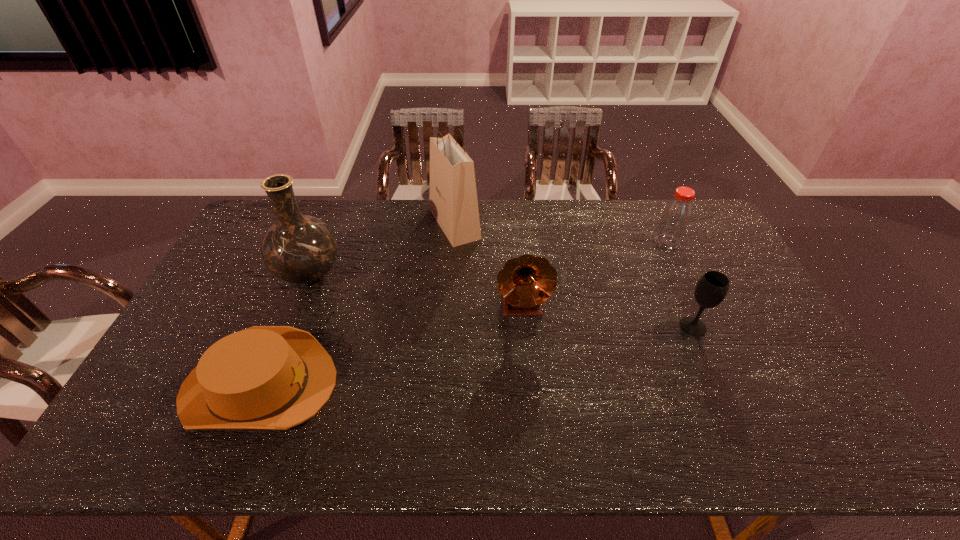
Locate an element on the screen. This screenshot has height=540, width=960. vacant space that's between the wineglass and the shopping bag is located at coordinates (574, 275).

Locate an element on the screen. vacant area between the vase and the phonograph_record is located at coordinates (416, 289).

Image resolution: width=960 pixels, height=540 pixels. Find the location of `free area in between the third object from left to right and the wineglass`. free area in between the third object from left to right and the wineglass is located at coordinates (574, 275).

Find the location of a particular element. This screenshot has height=540, width=960. vacant space that's between the vase and the wineglass is located at coordinates (501, 300).

At what (x,y) coordinates should I click in order to perform the action: click on free space between the vase and the phonograph_record. Please return your answer as a coordinate pair (x, y). This screenshot has width=960, height=540. Looking at the image, I should click on (416, 289).

Where is `free spot between the phonograph_record and the wineglass`? free spot between the phonograph_record and the wineglass is located at coordinates (608, 316).

Identify which object is the third nearest to the cowboy hat. Please provide its 2D coordinates. Your answer should be formatted as a tuple, i.e. [(x, y)], where the tuple contains the x and y coordinates of a point satisfying the conditions above.

[(453, 202)]

Where is `object that stands as the fourth closest to the bottle`? The height and width of the screenshot is (540, 960). object that stands as the fourth closest to the bottle is located at coordinates (300, 249).

At what (x,y) coordinates should I click in order to perform the action: click on blank space that satisfies the following two spatial constraints: 1. on the front side of the wineglass; 2. on the front-facing side of the cowboy hat. Please return your answer as a coordinate pair (x, y). Looking at the image, I should click on (719, 385).

Locate an element on the screen. vacant region that satisfies the following two spatial constraints: 1. on the horn of the wineglass; 2. on the right side of the fourth object from left to right is located at coordinates (524, 326).